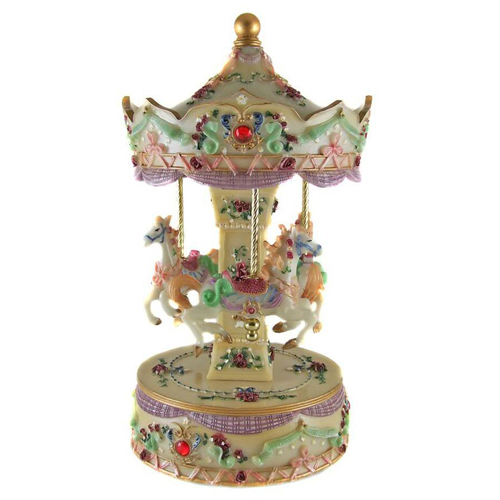
Image resolution: width=500 pixels, height=500 pixels. In order to click on figurine in this screenshot , I will do `click(236, 253)`.